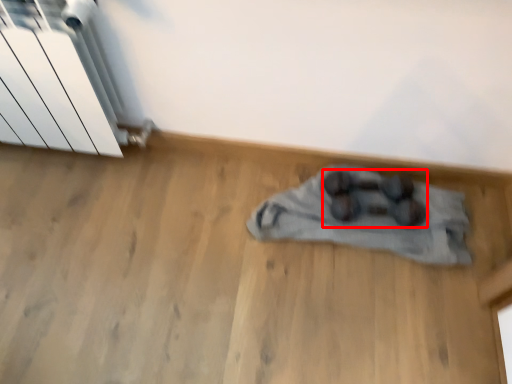
Question: Observing the image, what is the correct spatial positioning of footwear (annotated by the red box) in reference to radiator?

Choices:
 (A) right
 (B) left

Answer: (A)